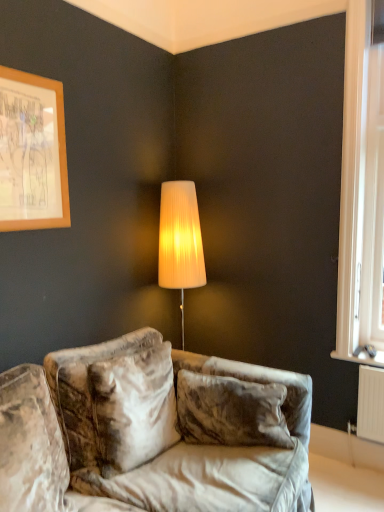
Question: Considering the positions of velvet couch at lower center and wooden frame at upper left in the image, is velvet couch at lower center taller or shorter than wooden frame at upper left?

Choices:
 (A) tall
 (B) short

Answer: (A)

Question: From a real-world perspective, is velvet couch at lower center above or below wooden frame at upper left?

Choices:
 (A) below
 (B) above

Answer: (A)

Question: Which object is positioned farthest from the velvet couch at lower center?

Choices:
 (A) wooden frame at upper left
 (B) white plastic window at right

Answer: (B)

Question: Estimate the real-world distances between objects in this image. Which object is closer to the velvet couch at lower center?

Choices:
 (A) wooden frame at upper left
 (B) white plastic window at right

Answer: (A)